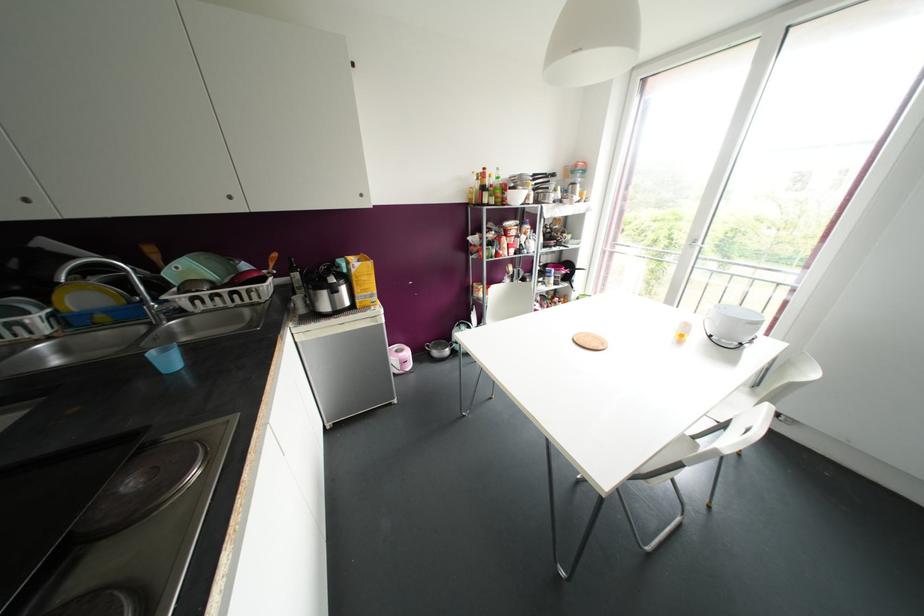
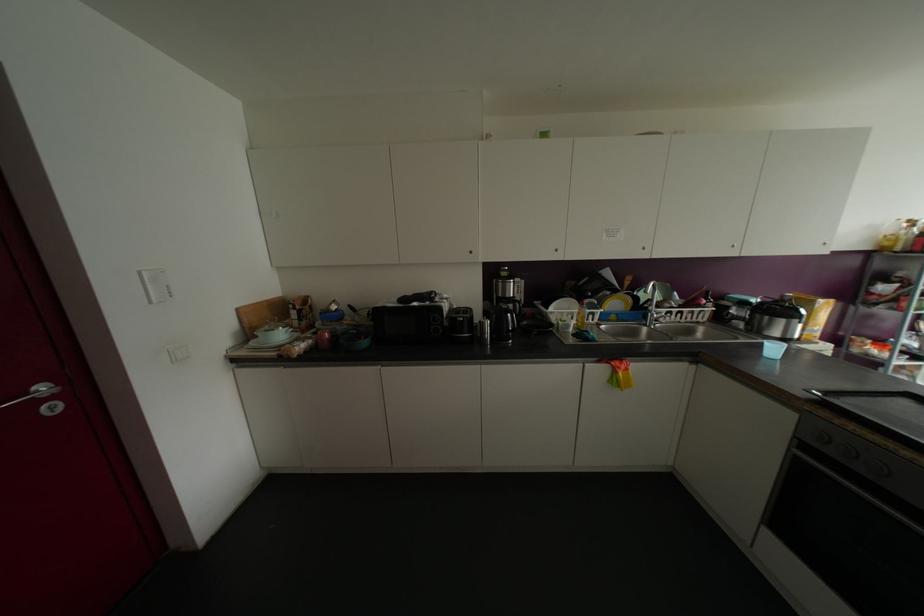
The point at (84, 296) is marked in the first image. Where is the corresponding point in the second image?

(614, 302)